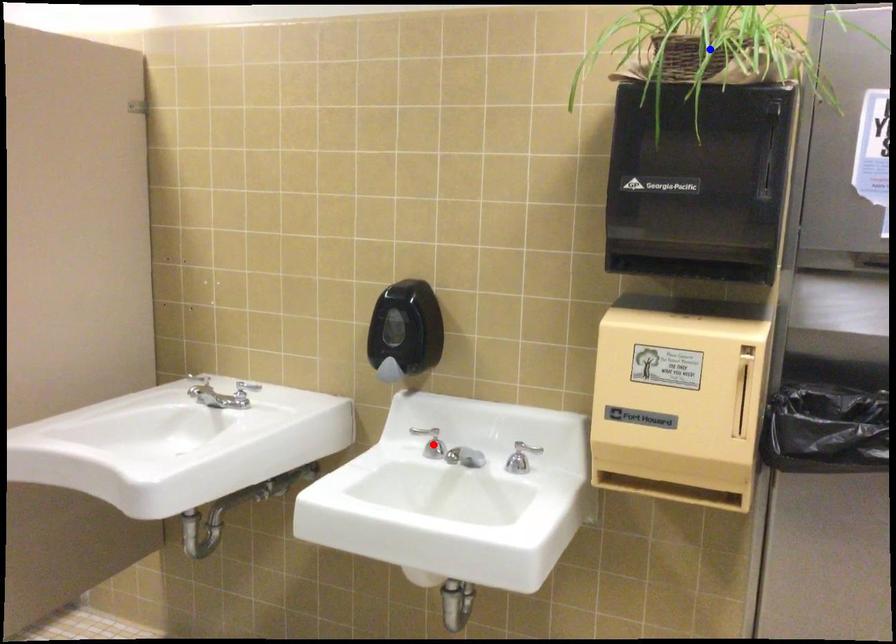
Question: Two points are marked on the image. Which point is closer to the camera?

Choices:
 (A) Blue point is closer.
 (B) Red point is closer.

Answer: (A)